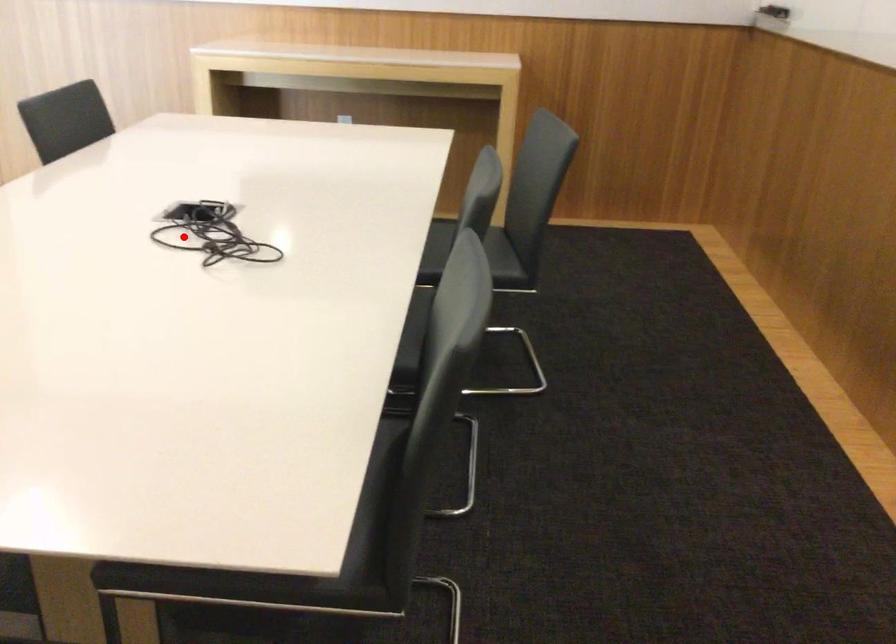
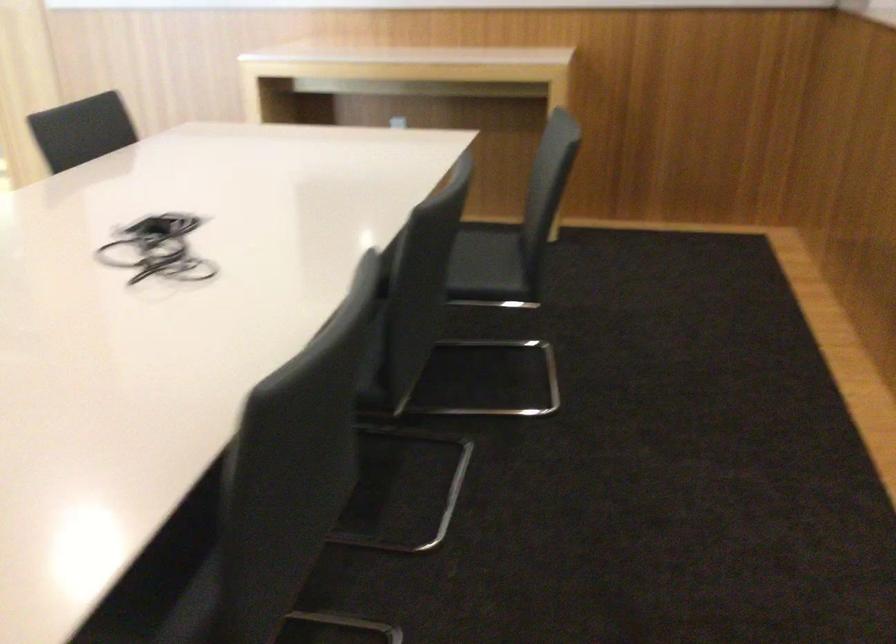
In the second image, find the point that corresponds to the highlighted location in the first image.

(158, 249)